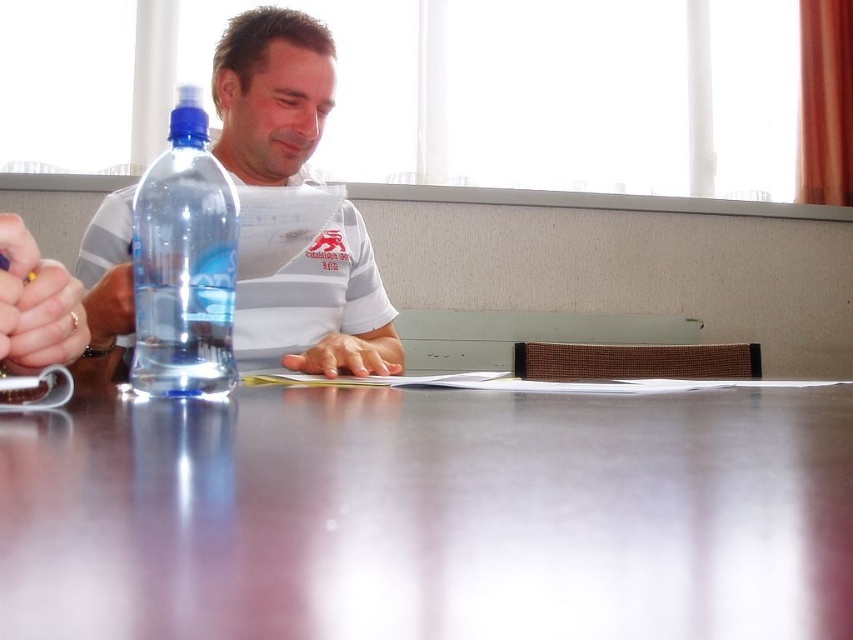
Question: Considering the real-world distances, which object is closest to the matte plastic water bottle at left?

Choices:
 (A) glossy plastic table at center
 (B) transparent plastic bottle at center

Answer: (B)

Question: Can you confirm if matte plastic water bottle at left is wider than transparent plastic bottle at center?

Choices:
 (A) no
 (B) yes

Answer: (B)

Question: Can you confirm if glossy plastic table at center is smaller than matte plastic water bottle at left?

Choices:
 (A) no
 (B) yes

Answer: (B)

Question: Which of the following is the farthest from the observer?

Choices:
 (A) matte plastic water bottle at left
 (B) transparent plastic bottle at center

Answer: (A)

Question: Which point is farther from the camera taking this photo?

Choices:
 (A) (524, 449)
 (B) (257, 333)

Answer: (B)

Question: Is glossy plastic table at center positioned before matte plastic water bottle at left?

Choices:
 (A) no
 (B) yes

Answer: (B)